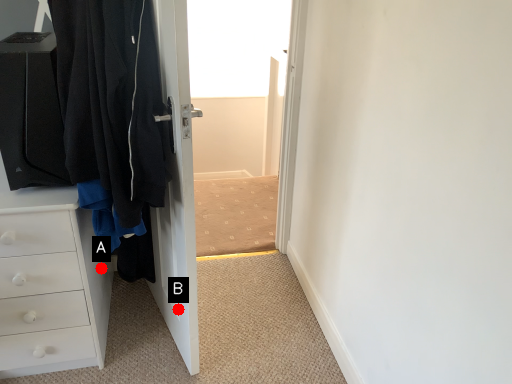
Question: Two points are circled on the image, labeled by A and B beside each circle. Which point appears closest to the camera in this image?

Choices:
 (A) A is closer
 (B) B is closer

Answer: (B)